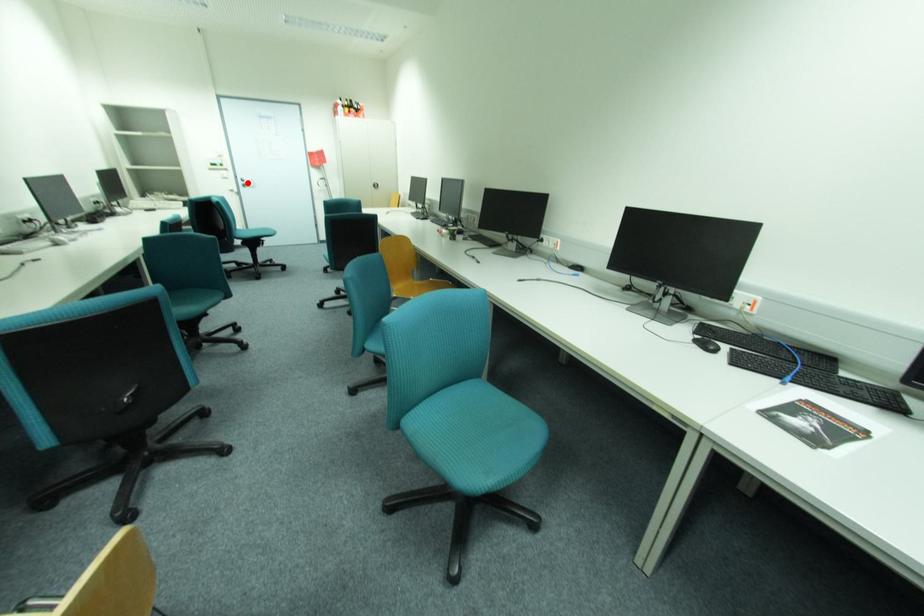
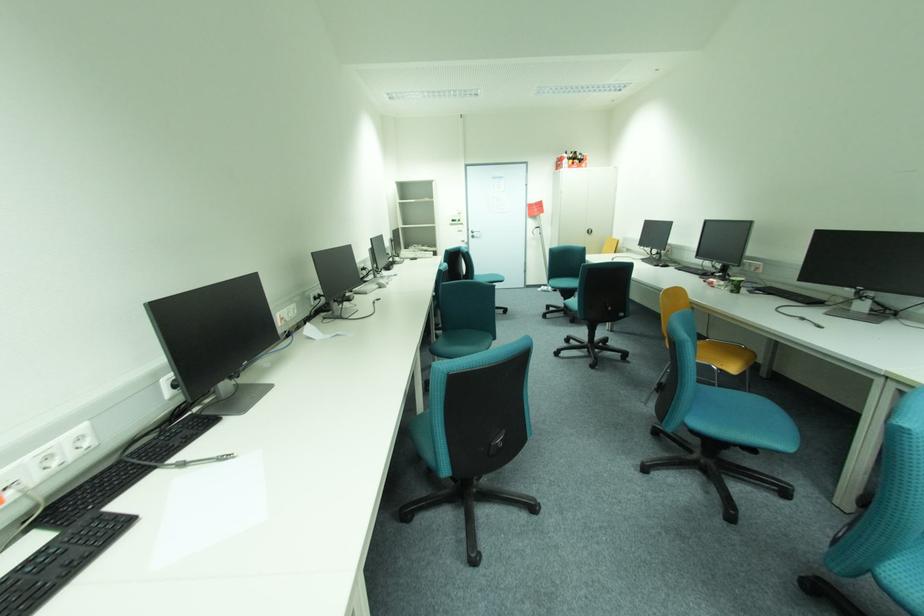
In the second image, find the point that corresponds to the highlighted location in the first image.

(477, 235)